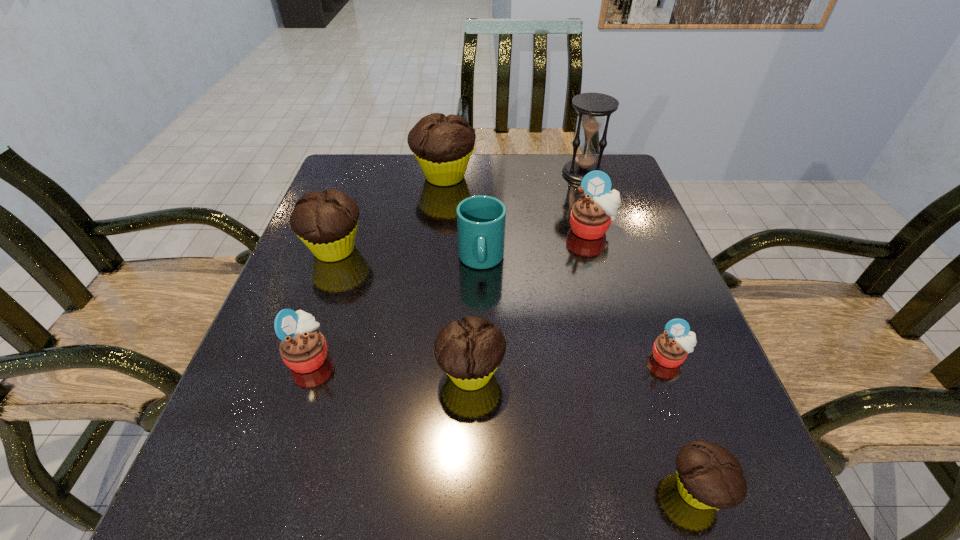
You are a GUI agent. You are given a task and a screenshot of the screen. Output one action in this format:
    pyautogui.click(x=<x>, y=<y>)
    Task: Click on the black hourglass
    
    Given the screenshot: What is the action you would take?
    pyautogui.click(x=592, y=107)

This screenshot has height=540, width=960. What are the coordinates of `the tallest object` in the screenshot? It's located at (592, 107).

Locate an element on the screen. the biggest chocolate muffin is located at coordinates (443, 145).

You are a GUI agent. You are given a task and a screenshot of the screen. Output one action in this format:
    pyautogui.click(x=<x>, y=<y>)
    Task: Click on the farthest muffin
    This screenshot has height=540, width=960.
    Given the screenshot: What is the action you would take?
    pyautogui.click(x=443, y=145)

You are a GUI agent. You are given a task and a screenshot of the screen. Output one action in this format:
    pyautogui.click(x=<x>, y=<y>)
    Task: Click on the biggest pink muffin
    
    Given the screenshot: What is the action you would take?
    pyautogui.click(x=591, y=216)

Identify the location of the leftmost chocolate muffin. (326, 222).

Locate an element on the screen. The width and height of the screenshot is (960, 540). the third smallest chocolate muffin is located at coordinates (326, 222).

Identify the location of cup. (481, 220).

Where is `the second smallest pink muffin`? the second smallest pink muffin is located at coordinates (303, 348).

The height and width of the screenshot is (540, 960). Identify the location of the third biggest chocolate muffin. (469, 351).